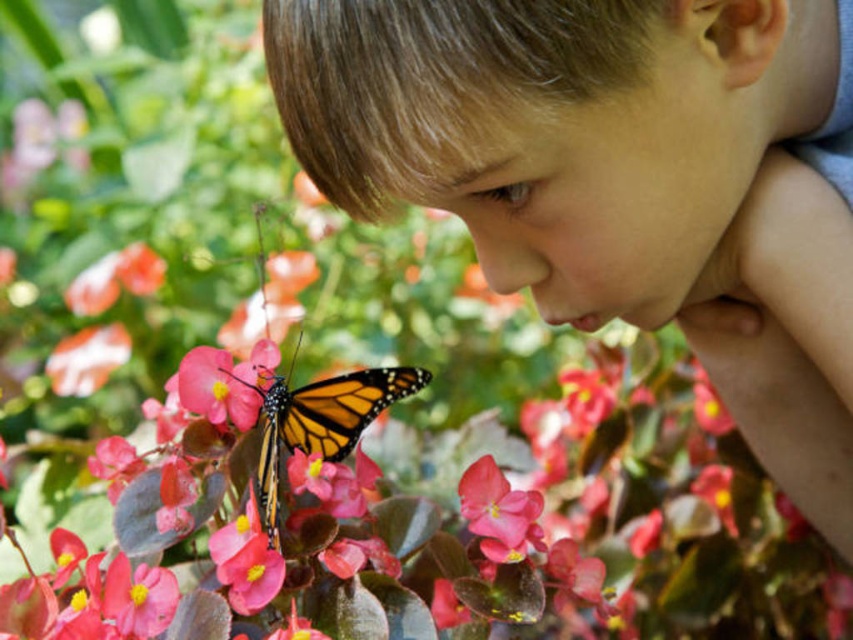
Measure the distance between point (572, 29) and camera.

Point (572, 29) and camera are 21.80 inches apart.

Identify the location of smooth skin child at center. (618, 177).

Between orange and black spotted wings at center and matte pink petal at center, which one has more height?

Standing taller between the two is orange and black spotted wings at center.

Based on the photo, is orange and black spotted wings at center smaller than matte pink petal at center?

Actually, orange and black spotted wings at center might be larger than matte pink petal at center.

What do you see at coordinates (318, 420) in the screenshot? The image size is (853, 640). I see `orange and black spotted wings at center` at bounding box center [318, 420].

The width and height of the screenshot is (853, 640). Find the location of `orange and black spotted wings at center`. orange and black spotted wings at center is located at coordinates (318, 420).

Does smooth pink petal at center come in front of matte pink petal at center?

Yes, smooth pink petal at center is closer to the viewer.

Who is more distant from viewer, (227, 417) or (122, 348)?

Point (122, 348)

Does point (251, 364) come behind point (68, 381)?

No.

I want to click on smooth pink petal at center, so click(x=218, y=387).